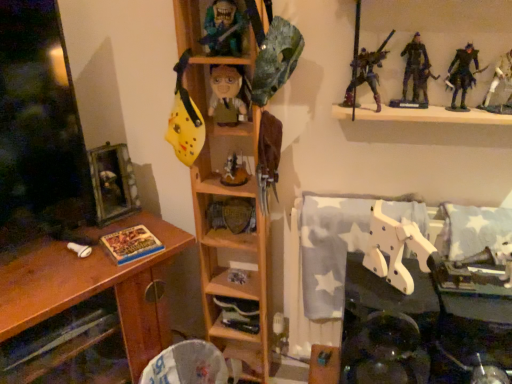
Question: Is wooden framed picture at left located within wooden shelf at center, which is the 2th shelf from left to right?

Choices:
 (A) no
 (B) yes

Answer: (A)

Question: Is wooden shelf at center, the 3th shelf positioned from the right, outside wooden framed picture at left?

Choices:
 (A) yes
 (B) no

Answer: (A)

Question: Is wooden shelf at center, the 3th shelf positioned from the right, looking in the opposite direction of wooden framed picture at left?

Choices:
 (A) no
 (B) yes

Answer: (A)

Question: Does wooden shelf at center, which is the 2th shelf from left to right, have a larger size compared to wooden framed picture at left?

Choices:
 (A) no
 (B) yes

Answer: (B)

Question: From the image's perspective, is wooden shelf at center, the 3th shelf positioned from the right, located beneath wooden framed picture at left?

Choices:
 (A) yes
 (B) no

Answer: (A)

Question: Considering the relative sizes of wooden shelf at center, which is the 2th shelf from left to right, and wooden framed picture at left in the image provided, is wooden shelf at center, which is the 2th shelf from left to right, wider than wooden framed picture at left?

Choices:
 (A) yes
 (B) no

Answer: (A)

Question: Is dark blue fabric figure at upper right, which appears as the first person when viewed from the right, aimed at dark gray plastic figure at upper right, which appears as the second toy when viewed from the top?

Choices:
 (A) no
 (B) yes

Answer: (A)

Question: Is dark blue fabric figure at upper right, which appears as the first person when viewed from the right, at the left side of dark gray plastic figure at upper right, which appears as the second toy when viewed from the top?

Choices:
 (A) no
 (B) yes

Answer: (A)

Question: Does dark blue fabric figure at upper right, which appears as the first person when viewed from the right, have a greater height compared to dark gray plastic figure at upper right, marked as the 2th toy in a right-to-left arrangement?

Choices:
 (A) no
 (B) yes

Answer: (A)

Question: From the image's perspective, is dark blue fabric figure at upper right, the 3th person in the left-to-right sequence, over dark gray plastic figure at upper right, which appears as the second toy when viewed from the top?

Choices:
 (A) no
 (B) yes

Answer: (A)

Question: Is dark blue fabric figure at upper right, the 3th person in the left-to-right sequence, not inside dark gray plastic figure at upper right, arranged as the fourth toy when ordered from the bottom?

Choices:
 (A) yes
 (B) no

Answer: (A)

Question: Is dark blue fabric figure at upper right, which appears as the first person when viewed from the right, next to dark gray plastic figure at upper right, arranged as the fourth toy when ordered from the bottom, and touching it?

Choices:
 (A) yes
 (B) no

Answer: (A)

Question: Is dark gray plastic figure at upper right, which is the fourth toy from left to right, further to camera compared to wooden shelf at center, the 3th shelf positioned from the right?

Choices:
 (A) yes
 (B) no

Answer: (A)